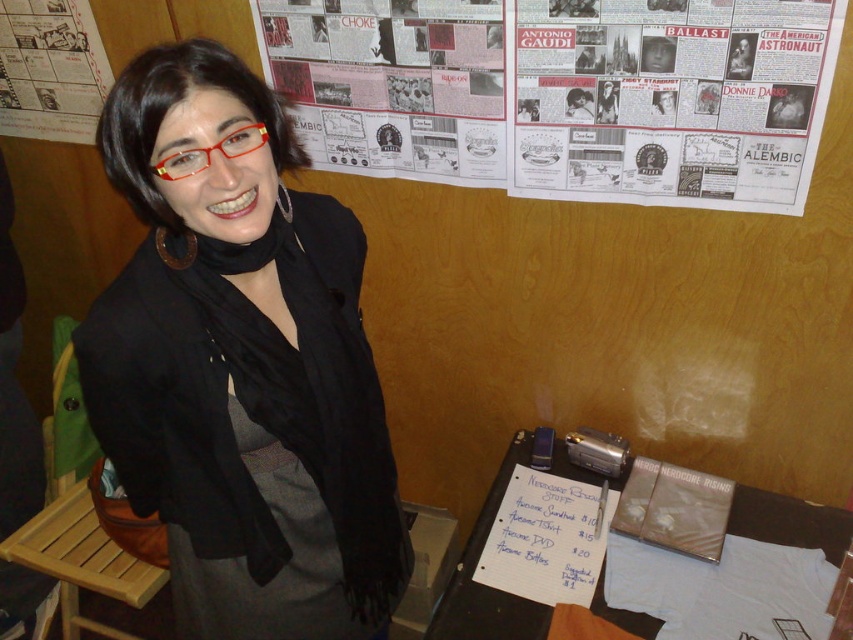
You are a photographer standing in front of the scene. You want to take a photo of the black matte scarf at center and the white paper posters at upper center. Which object will appear larger in the photo?

The black matte scarf at center will appear larger in the photo because it is closer to the viewer than the white paper posters at upper center.